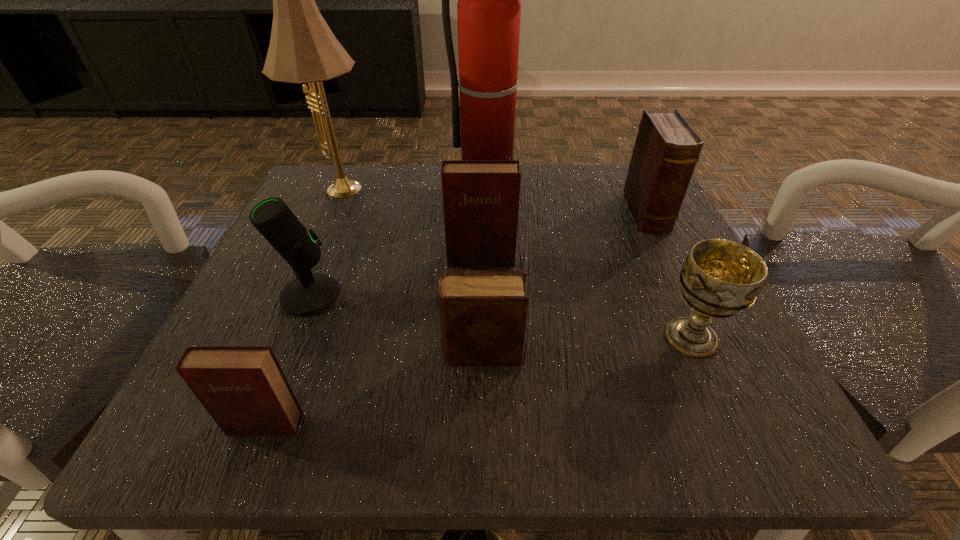
This screenshot has width=960, height=540. I want to click on free space located 0.300m on the spine side of the nearer brown diary, so click(x=228, y=353).

This screenshot has height=540, width=960. I want to click on fire extinguisher situated at the far edge, so click(489, 8).

At what (x,y) coordinates should I click in order to perform the action: click on lampshade located at the far edge. Please return your answer as a coordinate pair (x, y). This screenshot has height=540, width=960. Looking at the image, I should click on (303, 49).

Identify the location of diary that is at the far edge. This screenshot has height=540, width=960. (666, 150).

I want to click on object that is positioned at the near edge, so click(x=243, y=388).

Where is `lampshade that is at the left edge`? This screenshot has width=960, height=540. lampshade that is at the left edge is located at coordinates (303, 49).

Identify the location of microphone that is at the left edge. This screenshot has height=540, width=960. click(309, 294).

Where is `diary present at the left edge`? The image size is (960, 540). diary present at the left edge is located at coordinates (243, 388).

Identify the location of diary that is positioned at the right edge. This screenshot has height=540, width=960. (666, 150).

This screenshot has height=540, width=960. Identify the location of chalice at the right edge. (719, 278).